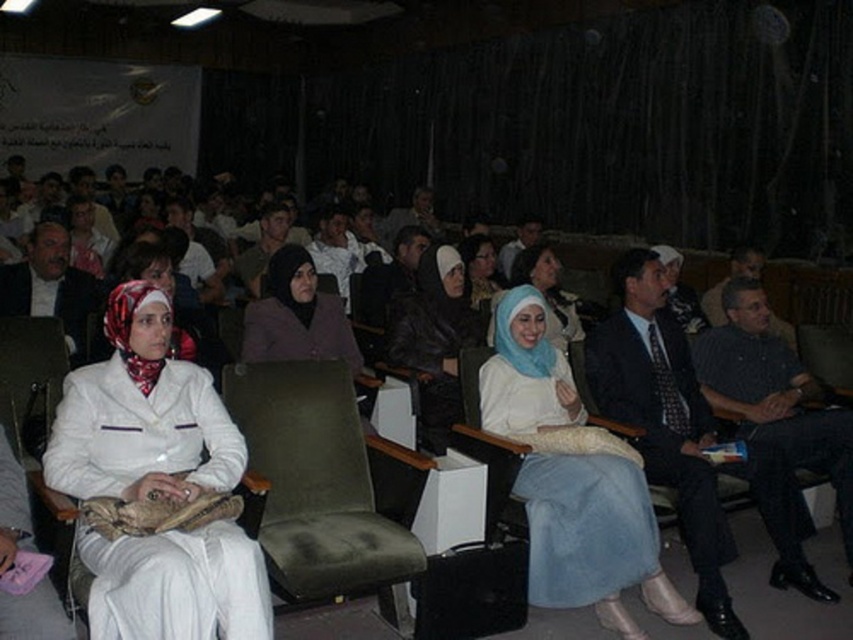
Question: Is matte black shirt at center thinner than light blue fabric hijab at center?

Choices:
 (A) yes
 (B) no

Answer: (B)

Question: Which object is closer to the camera taking this photo?

Choices:
 (A) matte purple hijab at center
 (B) matte black jacket at center
 (C) white fabric headscarf at left
 (D) dark suit at center

Answer: (C)

Question: Which object is closer to the camera taking this photo?

Choices:
 (A) matte purple hijab at center
 (B) white fabric headscarf at center

Answer: (B)

Question: Which point is farther to the camera?

Choices:
 (A) white fabric headscarf at left
 (B) white fabric headscarf at center

Answer: (B)

Question: Does matte purple hijab at center appear on the left side of matte black shirt at center?

Choices:
 (A) no
 (B) yes

Answer: (B)

Question: Is green fabric chair at center smaller than dark gray shirt at center?

Choices:
 (A) yes
 (B) no

Answer: (A)